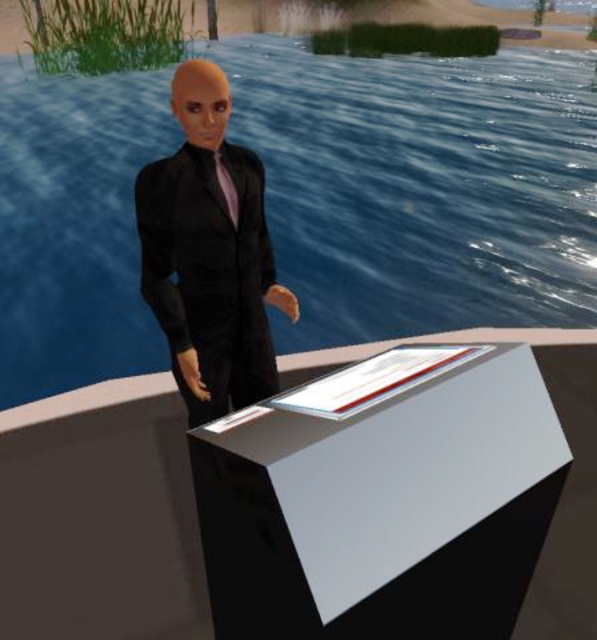
You are a photographer positioned at the edge of the water. You want to take a photo of the matte black tie at center and the blue glossy water at center. Which object will appear closer to the camera in the photo?

The blue glossy water at center will appear closer to the camera in the photo because the matte black tie at center is positioned behind it.

You are planning to place a new decorative statue that is 1 meter wide between the blue glossy water at center and the white glossy table at center. Based on their widths, can the statue fit between them without overlapping either object?

The blue glossy water at center might be wider than the white glossy table at center, but since the exact width difference isn not specified, it is uncertain whether the 1 meter wide statue can fit between them without overlapping. More information is needed to determine the feasibility.

You are a photographer planning to take a portrait of the figure in the scene. The blue glossy water at center and the matte black tie at center are both visible in the frame. Which object is closer to the camera, and why?

The blue glossy water at center is closer to the camera because it is positioned over the matte black tie at center, indicating it is in a forward layer in the scene.